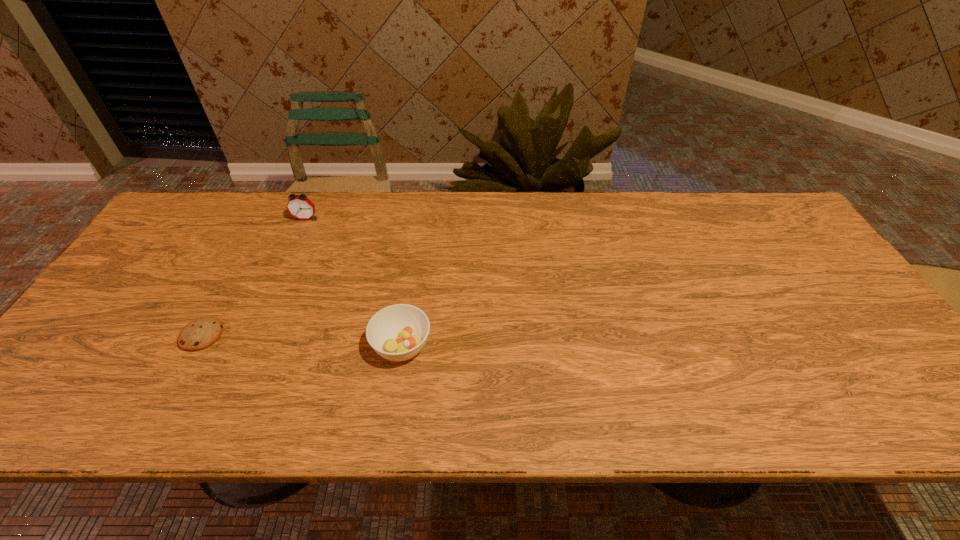
Locate an element on the screen. This screenshot has width=960, height=540. the farthest object is located at coordinates (299, 206).

Locate an element on the screen. the second object from right to left is located at coordinates (299, 206).

This screenshot has height=540, width=960. I want to click on the second tallest object, so 398,332.

Locate an element on the screen. The height and width of the screenshot is (540, 960). soup bowl is located at coordinates (398, 332).

Where is `the leftmost object`? The width and height of the screenshot is (960, 540). the leftmost object is located at coordinates coord(199,334).

This screenshot has height=540, width=960. I want to click on cookie, so click(199, 334).

Where is `vacant space situated 0.360m on the clock face of the tallest object`? This screenshot has height=540, width=960. vacant space situated 0.360m on the clock face of the tallest object is located at coordinates (264, 312).

Identify the location of vacant area situated on the back of the soup bowl. (409, 298).

At what (x,y) coordinates should I click in order to perform the action: click on free space located 0.120m on the back of the shortest object. Please return your answer as a coordinate pair (x, y). Looking at the image, I should click on (229, 284).

The height and width of the screenshot is (540, 960). Identify the location of object that is at the far edge. (299, 206).